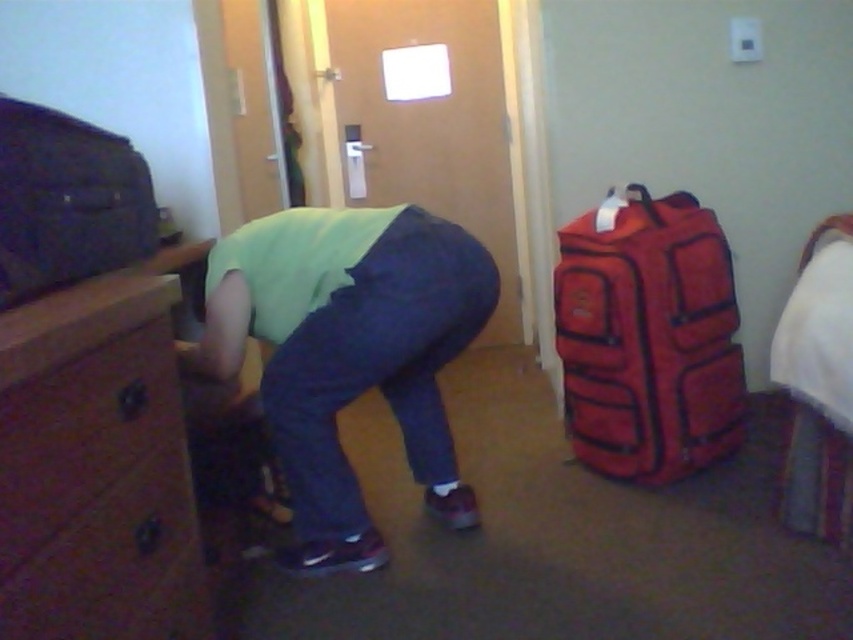
You are a hotel guest who just entered the room and noticed the brown wood dresser at left and the green matte shirt at center. Which object is bigger?

The brown wood dresser at left is smaller than the green matte shirt at center, so the green matte shirt at center is bigger.

You are standing in a hotel room and need to move a cleaning cart through the space between the red fabric suitcase at right and the matte black suitcase at left. The cart is 3.5 feet wide. Based on the scene description, will the cart fit through the gap between these two suitcases?

The red fabric suitcase at right and matte black suitcase at left are 4.09 feet apart. Since the cart is 3.5 feet wide, which is narrower than the gap, the cart can fit through the space between them.

You are standing in the room and want to place a small lamp on the closest object to you. Which object should you choose between the brown wood dresser at left and the green matte shirt at center?

The brown wood dresser at left is closer to the viewer than the green matte shirt at center, so you should place the lamp on the brown wood dresser at left.